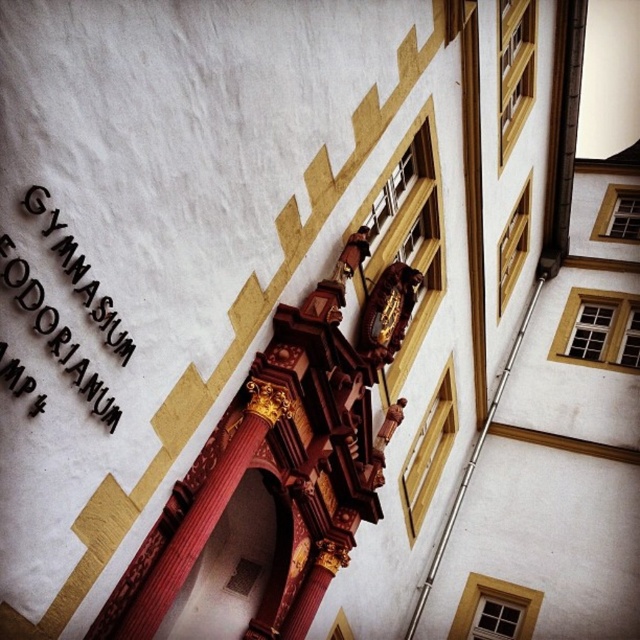
Which is more to the right, black metal sign at upper left or gold polished wood clock at center?

gold polished wood clock at center is more to the right.

Is black metal sign at upper left further to the viewer compared to gold polished wood clock at center?

That is False.

At what (x,y) coordinates should I click in order to perform the action: click on black metal sign at upper left. Please return your answer as a coordinate pair (x, y). Looking at the image, I should click on (x=54, y=332).